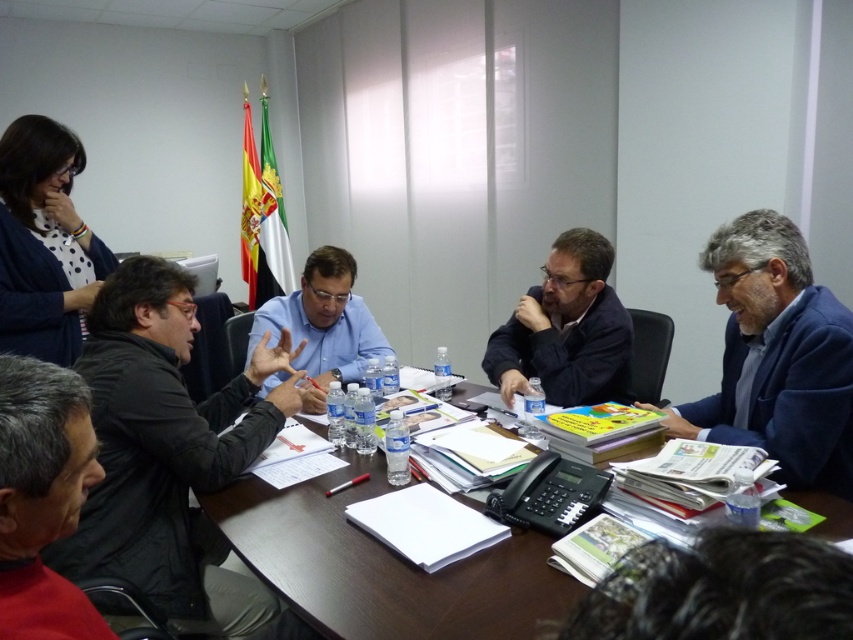
You are a photographer standing in front of the conference table where the black matte jacket at center is placed. You want to take a photo of the jacket but need to ensure you are close enough to capture details. If your camera can focus clearly on subjects within 3 feet, is your current position sufficient?

The distance between the black matte jacket at center and the camera is 4.40 feet, which is beyond the camera focus range of 3 feet. Move closer to ensure clear focus.

You are a new employee entering the meeting room and see the wooden table at center and the blue fabric suit at right. Which object is closer to the entrance of the room?

The wooden table at center is closer to the entrance of the room because it is in front of the blue fabric suit at right, meaning the table is between the entrance and the suit.

You are attending a meeting in an office and see the red knitwear at lower left and the dark blue jacket at center. Which object is closer to you?

The red knitwear at lower left is closer to you because it is in front of the dark blue jacket at center.